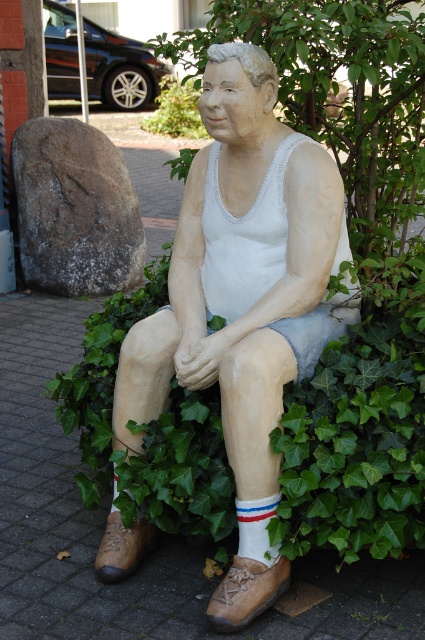
Question: Can you confirm if green leafy plant at upper center is bigger than white cotton sock at lower center?

Choices:
 (A) no
 (B) yes

Answer: (B)

Question: Which point is closer to the camera?

Choices:
 (A) (246, 506)
 (B) (251, 252)

Answer: (A)

Question: Which point is closer to the camera?

Choices:
 (A) (206, 216)
 (B) (258, 499)
 (C) (159, 124)

Answer: (B)

Question: Which point is farther to the camera?

Choices:
 (A) matte white statue at center
 (B) white cotton sock at lower center
 (C) green leafy plant at upper center

Answer: (C)

Question: Is matte white statue at center bigger than white cotton sock at lower center?

Choices:
 (A) no
 (B) yes

Answer: (B)

Question: Where is green leafy plant at upper center located in relation to white cotton sock at lower center in the image?

Choices:
 (A) below
 (B) above

Answer: (B)